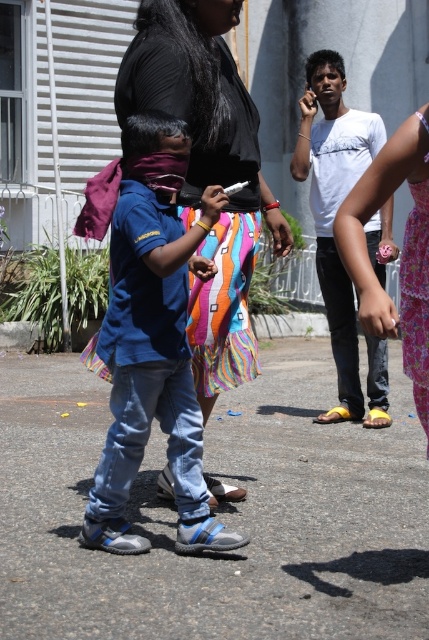
Which of these two, black fabric dress at center or white matte shirt at center, stands taller?

white matte shirt at center

Is black fabric dress at center smaller than white matte shirt at center?

Yes, black fabric dress at center is smaller than white matte shirt at center.

Is point (226, 237) closer to viewer compared to point (362, 170)?

Yes, it is.

Find the location of a particular element. This screenshot has width=429, height=640. black fabric dress at center is located at coordinates (208, 172).

Which is in front, point (117, 540) or point (323, 272)?

Point (117, 540)

Which of these two, blue denim jeans at center or white matte shirt at center, stands shorter?

blue denim jeans at center is shorter.

Does point (142, 355) come farther from viewer compared to point (335, 74)?

No, it is in front of (335, 74).

Where is `blue denim jeans at center`? blue denim jeans at center is located at coordinates (153, 340).

Measure the distance between blue denim jeans at center and black fabric dress at center.

The distance of blue denim jeans at center from black fabric dress at center is 20.61 inches.

Is point (178, 316) positioned in front of point (205, 157)?

Yes, point (178, 316) is closer to viewer.

What do you see at coordinates (153, 340) in the screenshot? I see `blue denim jeans at center` at bounding box center [153, 340].

At what (x,y) coordinates should I click in order to perform the action: click on blue denim jeans at center. Please return your answer as a coordinate pair (x, y). Image resolution: width=429 pixels, height=640 pixels. Looking at the image, I should click on (153, 340).